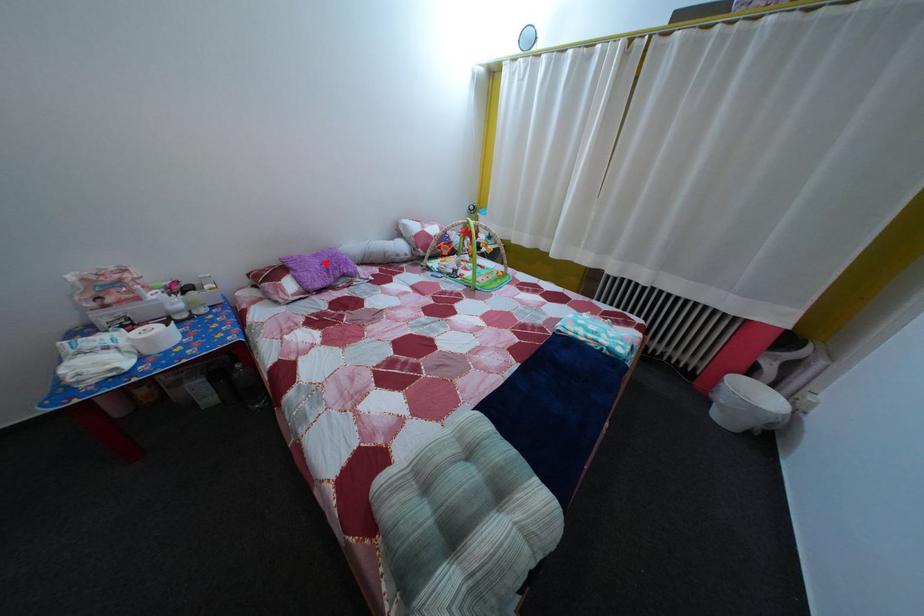
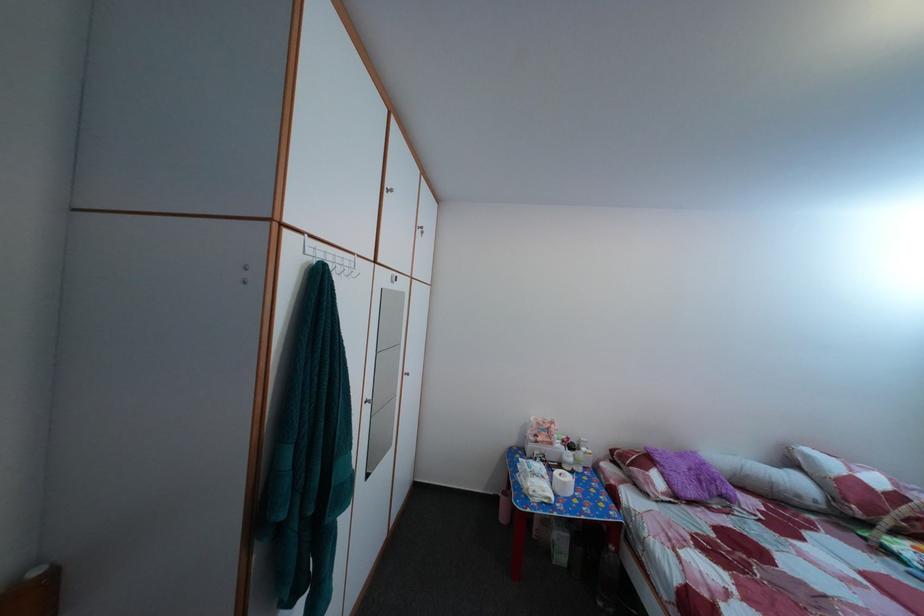
In the second image, find the point that corresponds to the highlighted location in the first image.

(689, 464)